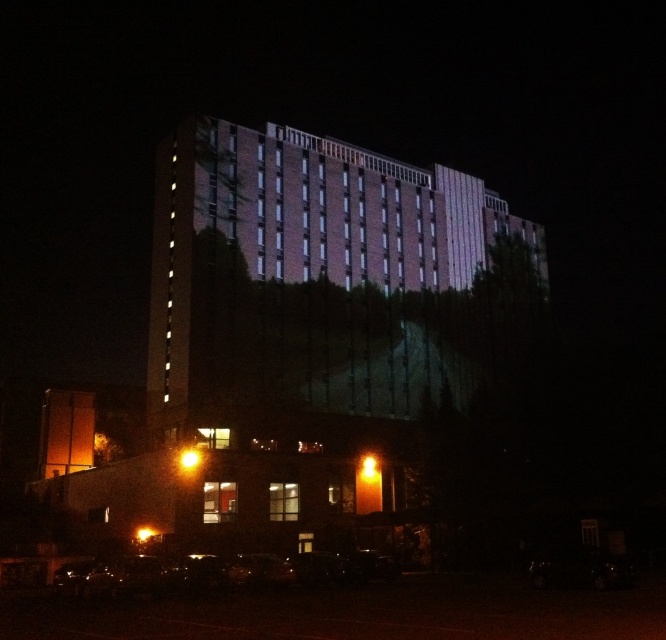
Question: Which of the following is the farthest from the observer?

Choices:
 (A) (226, 564)
 (B) (358, 177)

Answer: (B)

Question: Does brick textured building at center have a lesser width compared to shiny black car at lower center?

Choices:
 (A) yes
 (B) no

Answer: (B)

Question: In this image, where is brick textured building at center located relative to shiny black car at lower center?

Choices:
 (A) above
 (B) below

Answer: (A)

Question: Among these objects, which one is nearest to the camera?

Choices:
 (A) brick textured building at center
 (B) shiny black car at lower center

Answer: (B)

Question: Is brick textured building at center to the left of shiny black car at lower center from the viewer's perspective?

Choices:
 (A) no
 (B) yes

Answer: (A)